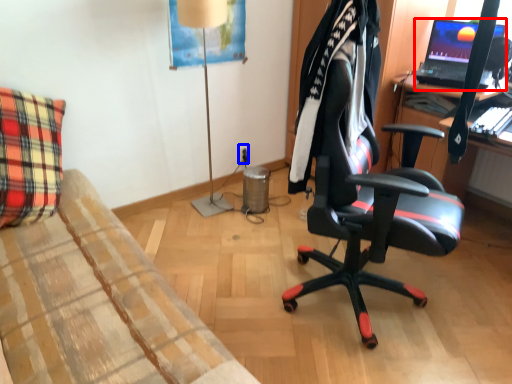
Question: Which of the following is the farthest to the observer, laptop (highlighted by a red box) or power outlet (highlighted by a blue box)?

Choices:
 (A) laptop
 (B) power outlet

Answer: (B)